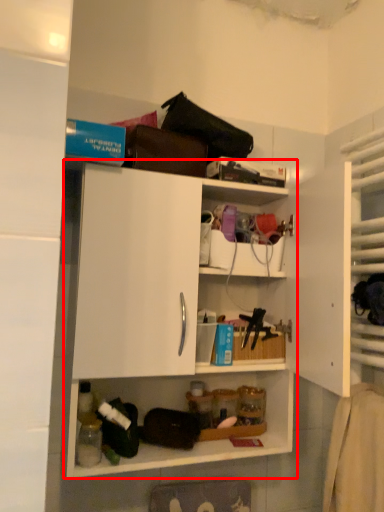
Question: From the image's perspective, where is shelf (annotated by the red box) located in relation to shelf in the image?

Choices:
 (A) below
 (B) above

Answer: (A)